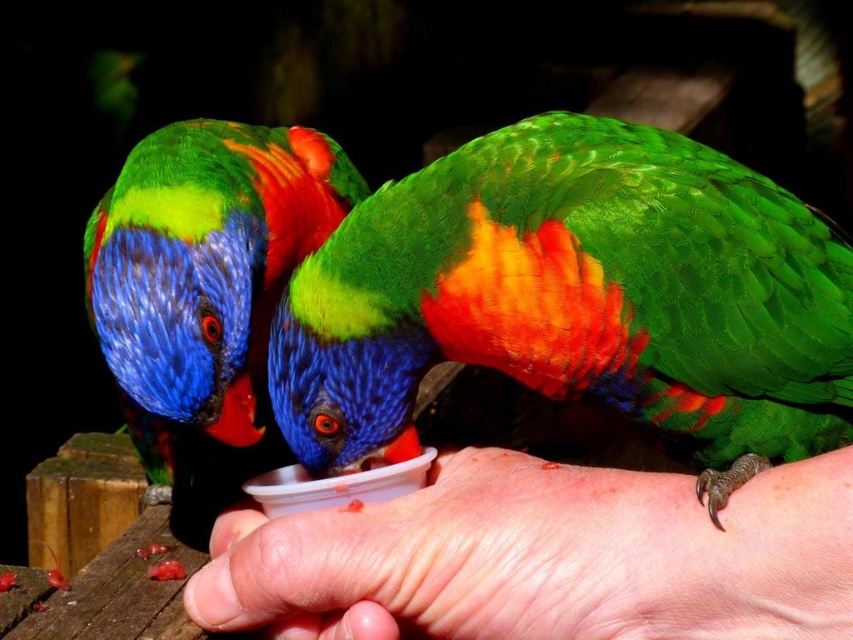
Between green glossy parrot at center and shiny multicolored parrot at center, which one is positioned lower?

shiny multicolored parrot at center

How much distance is there between green glossy parrot at center and shiny multicolored parrot at center?

A distance of 35.95 centimeters exists between green glossy parrot at center and shiny multicolored parrot at center.

Who is more forward, (822, 380) or (317, 216)?

Point (822, 380) is in front.

In order to click on green glossy parrot at center in this screenshot , I will do `click(576, 300)`.

Between green glossy parrot at center and smooth skin hand at lower center, which one has less height?

Standing shorter between the two is smooth skin hand at lower center.

Who is more forward, (463, 307) or (683, 564)?

Point (683, 564) is in front.

Where is `green glossy parrot at center`? The height and width of the screenshot is (640, 853). green glossy parrot at center is located at coordinates (576, 300).

Which of these two, smooth skin hand at lower center or shiny multicolored parrot at center, stands taller?

shiny multicolored parrot at center

How distant is smooth skin hand at lower center from shiny multicolored parrot at center?

smooth skin hand at lower center and shiny multicolored parrot at center are 20.91 inches apart from each other.

Identify the location of smooth skin hand at lower center. (544, 557).